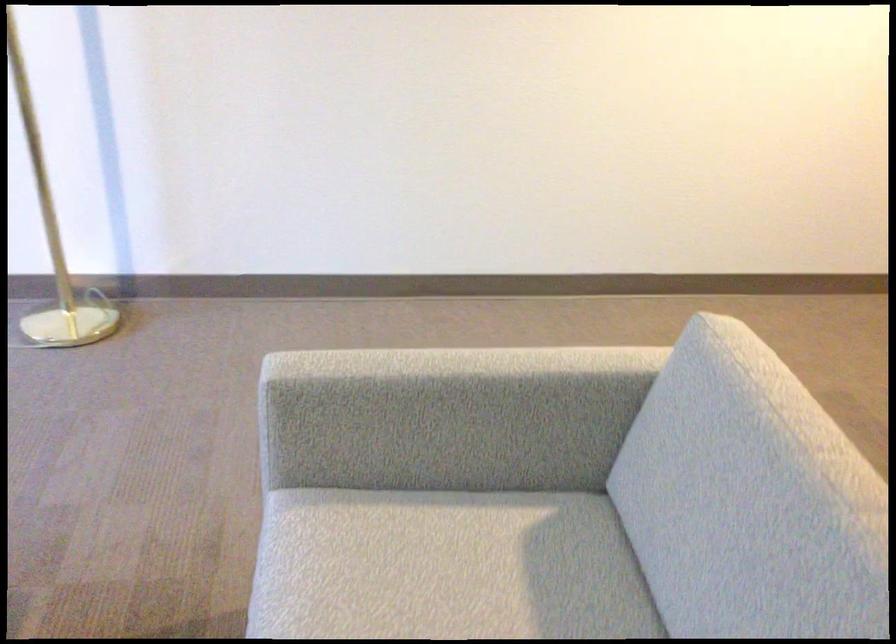
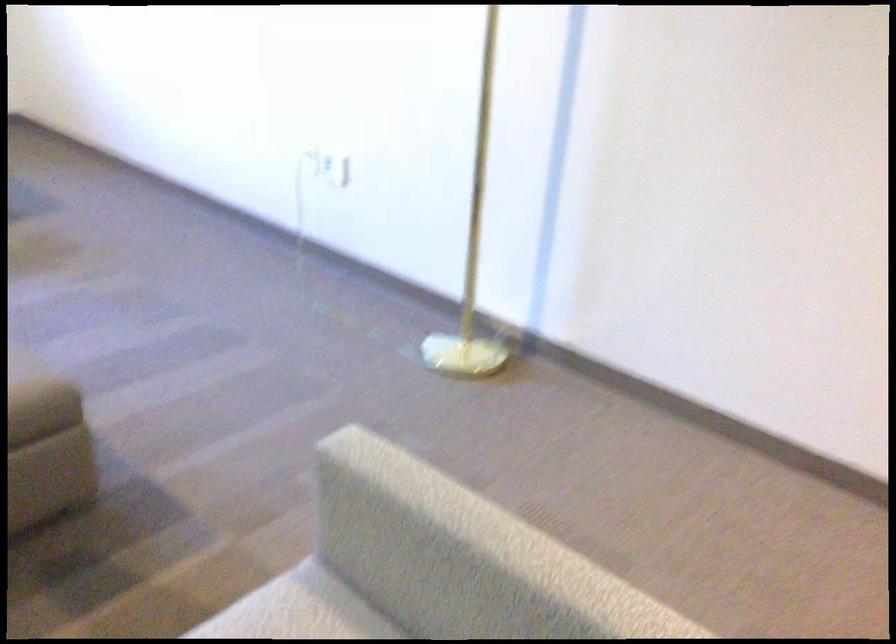
Question: Based on the continuous images, in which direction is the camera rotating? Reply with the corresponding letter.

Choices:
 (A) Left
 (B) Right
 (C) Up
 (D) Down

Answer: (A)